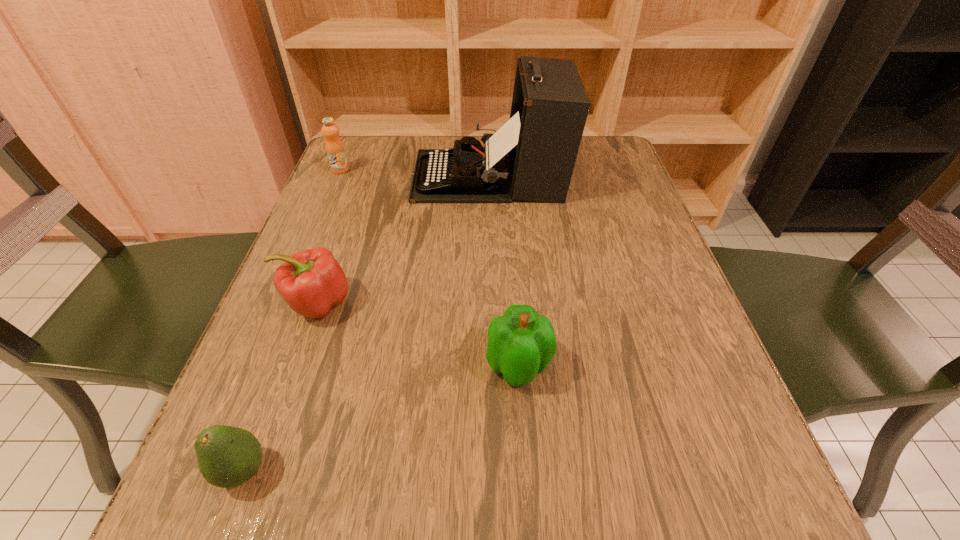
Locate an element on the screen. vacant space located on the front label of the orange juice is located at coordinates (300, 265).

Identify the location of vacant space situated 0.130m on the front of the right bell pepper. The image size is (960, 540). (527, 484).

The height and width of the screenshot is (540, 960). I want to click on free space located 0.300m on the front of the farther bell pepper, so click(x=242, y=520).

I want to click on vacant space located 0.240m on the right of the nearest object, so click(448, 471).

The width and height of the screenshot is (960, 540). I want to click on typewriter that is at the far edge, so click(x=531, y=157).

The image size is (960, 540). Find the location of `orange juice positioned at the far edge`. orange juice positioned at the far edge is located at coordinates click(x=334, y=147).

Locate an element on the screen. The width and height of the screenshot is (960, 540). object at the near edge is located at coordinates (227, 456).

You are a GUI agent. You are given a task and a screenshot of the screen. Output one action in this format:
    pyautogui.click(x=<x>, y=<y>)
    Task: Click on the orange juice that is at the left edge
    Image resolution: width=960 pixels, height=540 pixels.
    Given the screenshot: What is the action you would take?
    pyautogui.click(x=334, y=147)

Where is `bell pepper present at the left edge`? This screenshot has height=540, width=960. bell pepper present at the left edge is located at coordinates coord(311,282).

Where is `avocado that is at the left edge`? The width and height of the screenshot is (960, 540). avocado that is at the left edge is located at coordinates (227, 456).